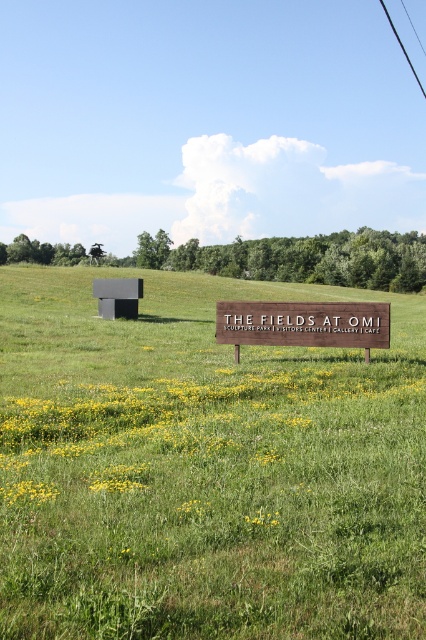
What do you see at coordinates (204, 468) in the screenshot? This screenshot has height=640, width=426. I see `black matte sculpture at upper left` at bounding box center [204, 468].

Where is `black matte sculpture at upper left`? This screenshot has height=640, width=426. black matte sculpture at upper left is located at coordinates 204,468.